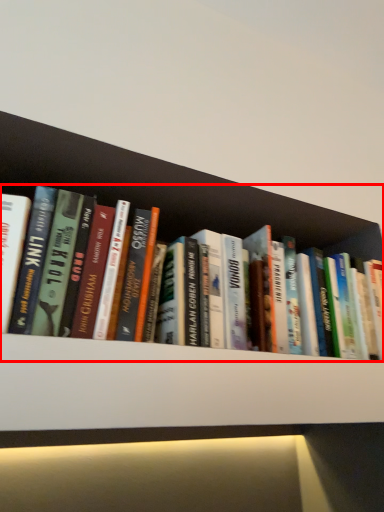
Question: From the image, what is the correct spatial relationship of book (annotated by the red box) in relation to shelf?

Choices:
 (A) left
 (B) right

Answer: (B)